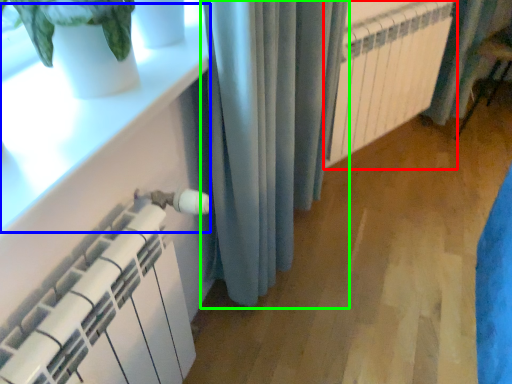
Question: Which object is the farthest from radiator (highlighted by a red box)? Choose among these: window sill (highlighted by a blue box) or curtain (highlighted by a green box).

Choices:
 (A) window sill
 (B) curtain

Answer: (A)